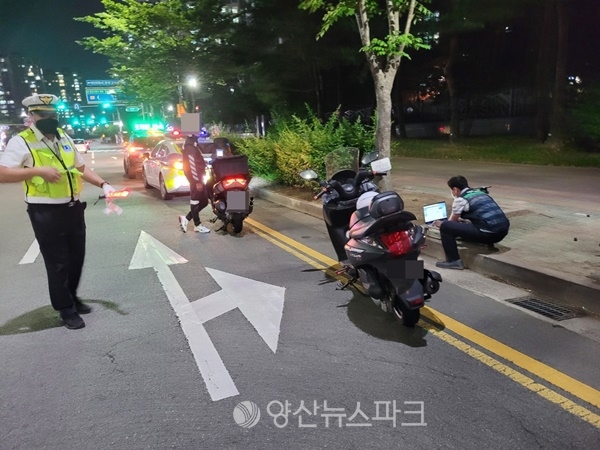
Locate an element on the screen. laptop is located at coordinates (429, 213).